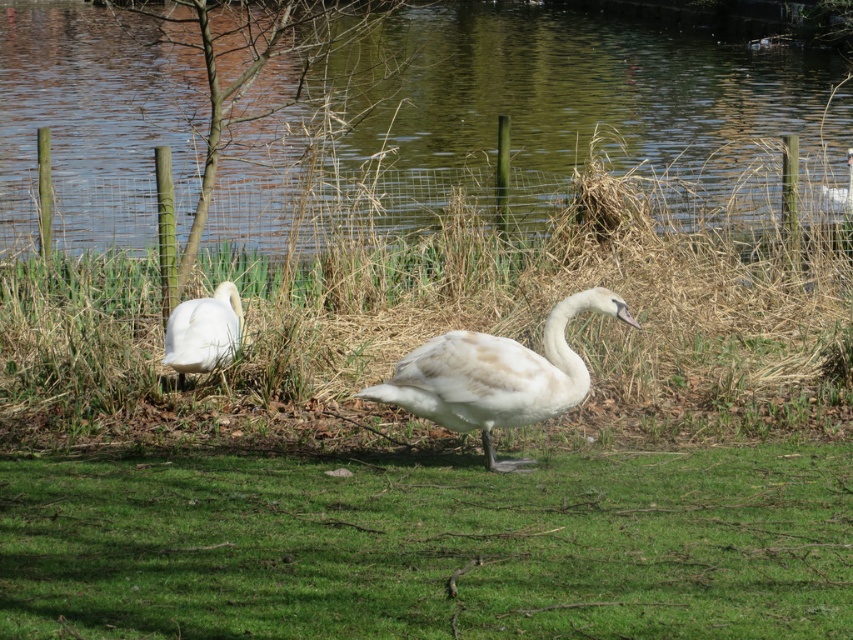
You are a photographer trying to capture both the green water at center and the white matte swan at center in a single shot. Based on their sizes in the image, which object would appear larger in your photo?

The green water at center appears larger in the photo because it is much taller than the white matte swan at center according to the description.

You are a photographer trying to capture the white matte swan at center in the foreground. You notice the green water at center is blocking your view. Can you adjust your position to see the swan clearly?

The green water at center is positioned over the white matte swan at center, so moving your camera angle downward or closer to the water level might allow you to see the swan beneath the water surface.